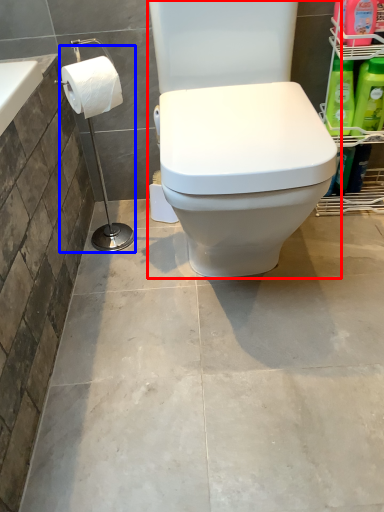
Question: Which object is closer to the camera taking this photo, toilet (highlighted by a red box) or shower (highlighted by a blue box)?

Choices:
 (A) toilet
 (B) shower

Answer: (A)